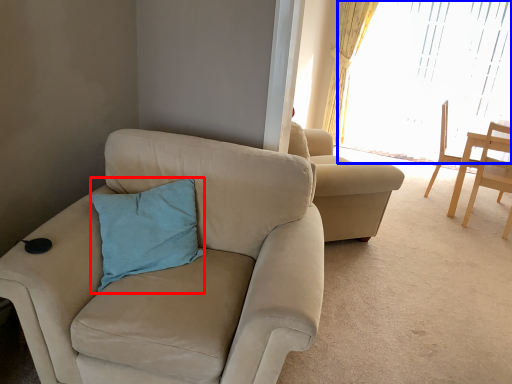
Question: Which point is closer to the camera, pillow (highlighted by a red box) or window (highlighted by a blue box)?

Choices:
 (A) pillow
 (B) window

Answer: (A)